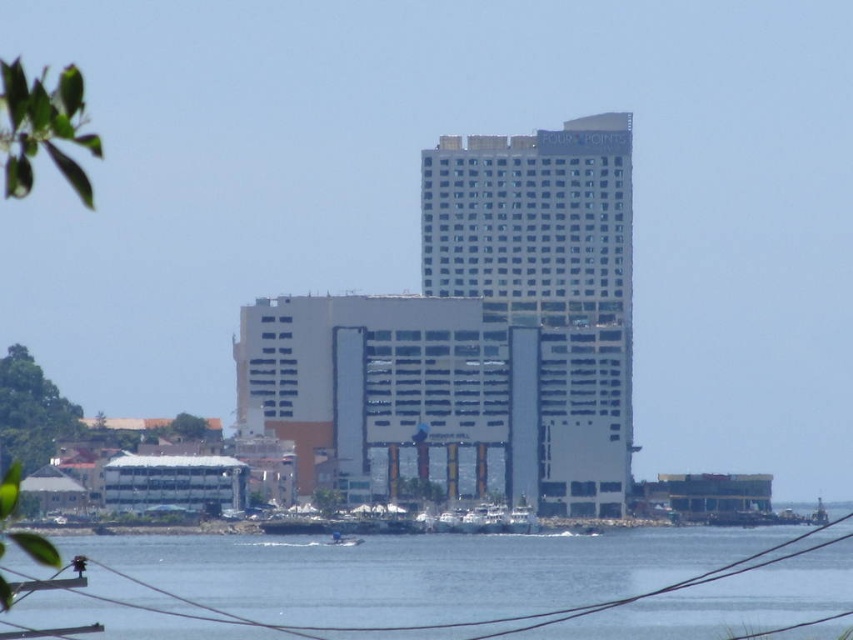
Question: In this image, where is white glass building at center located relative to blue plastic boat at lower center?

Choices:
 (A) right
 (B) left

Answer: (A)

Question: Is transparent water at lower center positioned before blue plastic boat at lower center?

Choices:
 (A) yes
 (B) no

Answer: (A)

Question: Which point appears farthest from the camera in this image?

Choices:
 (A) (332, 538)
 (B) (76, 541)

Answer: (B)

Question: Is white glass building at center positioned behind blue plastic boat at lower center?

Choices:
 (A) yes
 (B) no

Answer: (B)

Question: Which object is positioned farthest from the white glass building at center?

Choices:
 (A) blue plastic boat at lower center
 (B) transparent water at lower center

Answer: (A)

Question: Which object is the closest to the blue plastic boat at lower center?

Choices:
 (A) transparent water at lower center
 (B) white glass building at center

Answer: (A)